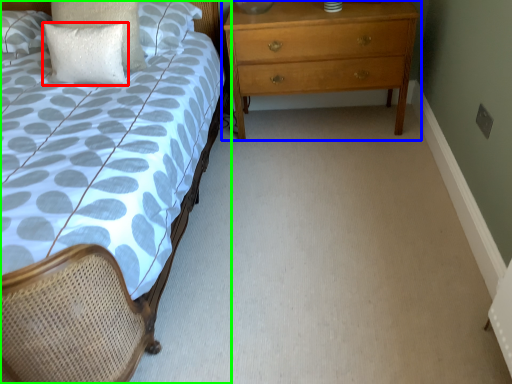
Question: Which object is positioned closest to pillow (highlighted by a red box)? Select from chest of drawers (highlighted by a blue box) and bed (highlighted by a green box).

Choices:
 (A) chest of drawers
 (B) bed

Answer: (A)